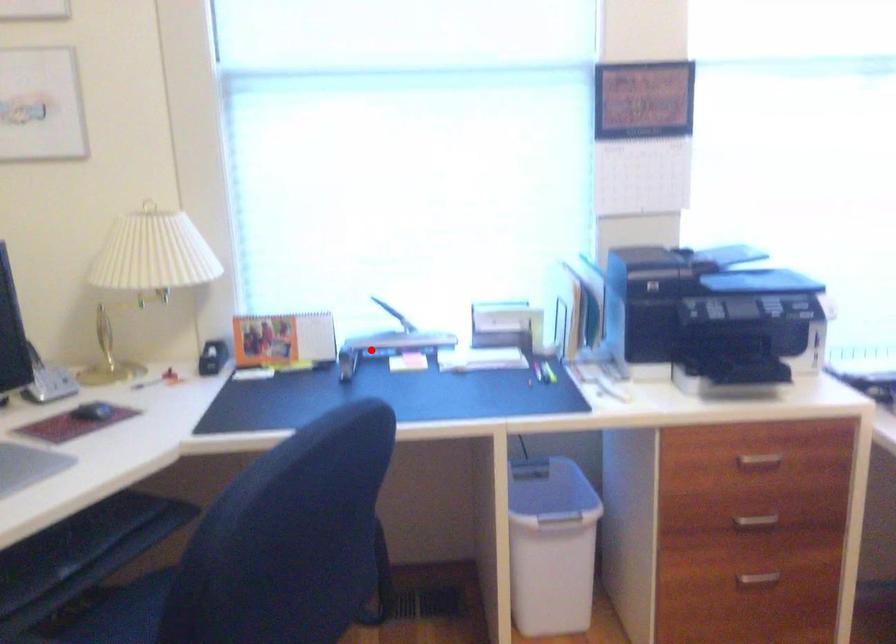
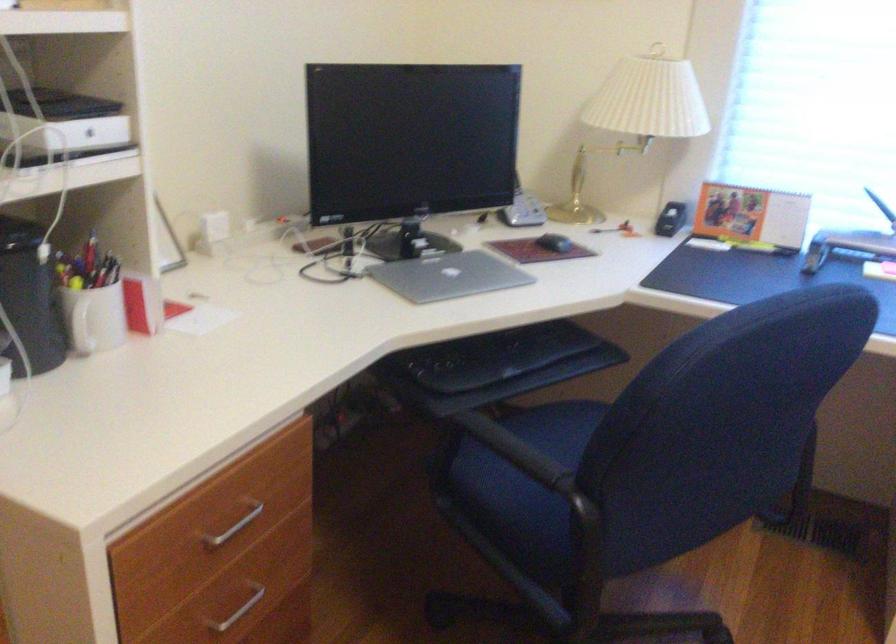
Question: A red point is marked in image1. In image2, is the corresponding 3D point closer to the camera or farther? Reply with the corresponding letter.

Choices:
 (A) The corresponding 3D point is closer.
 (B) The corresponding 3D point is farther.

Answer: (A)